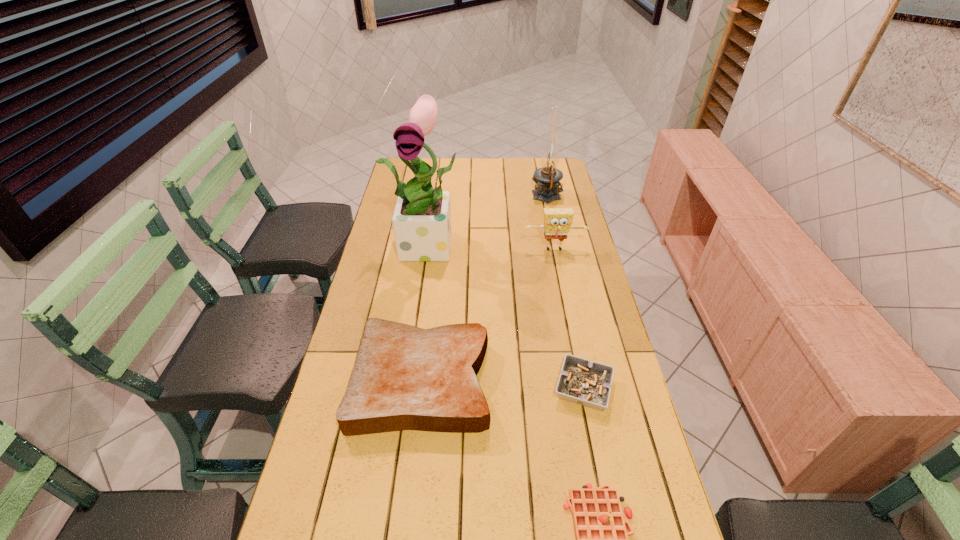
You are a GUI agent. You are given a task and a screenshot of the screen. Output one action in this format:
    pyautogui.click(x=<x>, y=<y>)
    Task: Click on the vacant space that satisfies the following two spatial constraints: 1. on the face of the ashtray; 2. on the right side of the sponge
    Image resolution: width=960 pixels, height=540 pixels.
    Given the screenshot: What is the action you would take?
    pyautogui.click(x=582, y=388)